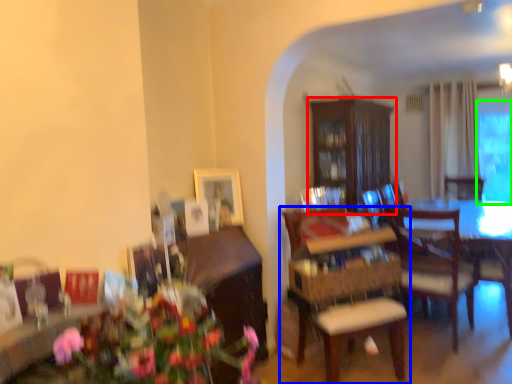
Question: Which is farther away from cabinetry (highlighted by a red box)? chair (highlighted by a blue box) or window screen (highlighted by a green box)?

Choices:
 (A) chair
 (B) window screen

Answer: (B)